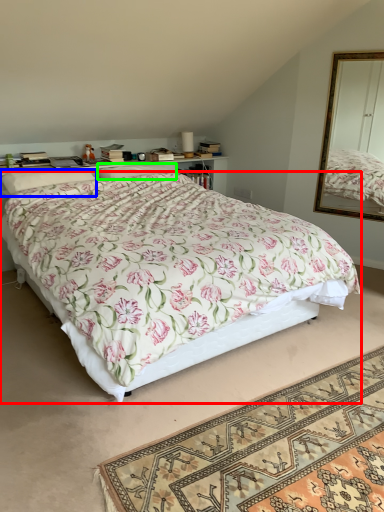
Question: Estimate the real-world distances between objects in this image. Which object is farther from bed (highlighted by a red box), pillow (highlighted by a blue box) or pillow (highlighted by a green box)?

Choices:
 (A) pillow
 (B) pillow

Answer: (B)